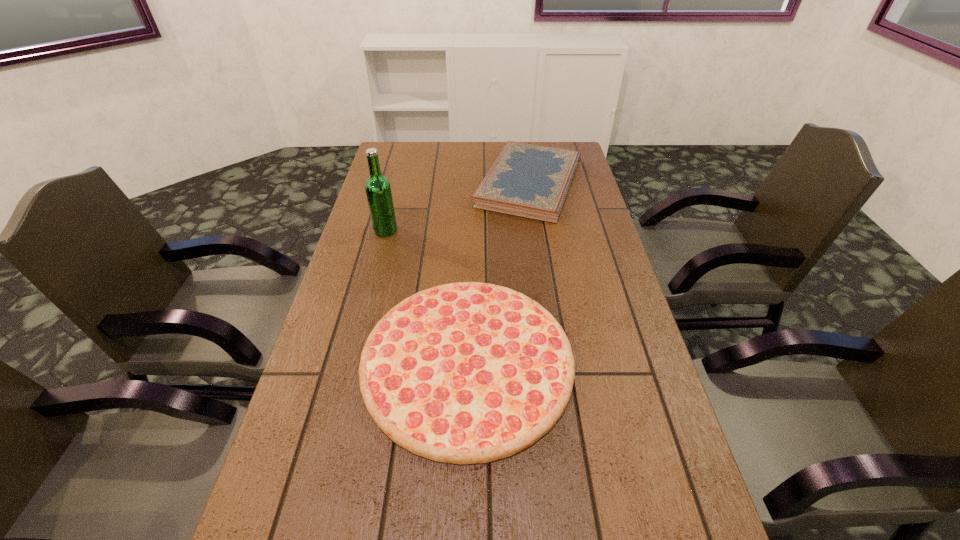
This screenshot has width=960, height=540. I want to click on object located at the right edge, so click(x=527, y=180).

At what (x,y) coordinates should I click in order to perform the action: click on object at the far right corner. Please return your answer as a coordinate pair (x, y). This screenshot has height=540, width=960. Looking at the image, I should click on (527, 180).

Where is `free point at the left edge`? The image size is (960, 540). free point at the left edge is located at coordinates click(358, 224).

In the image, there is a desktop. Where is `vacant space at the right edge`? This screenshot has height=540, width=960. vacant space at the right edge is located at coordinates (579, 187).

This screenshot has width=960, height=540. What are the coordinates of `vacant area that lies between the second shortest object and the tallest object` in the screenshot? It's located at (458, 207).

Find the location of a particular element. The width and height of the screenshot is (960, 540). free space that is in between the paperback book and the beer bottle is located at coordinates (458, 207).

Find the location of a particular element. Image resolution: width=960 pixels, height=540 pixels. vacant space that's between the beer bottle and the second tallest object is located at coordinates (458, 207).

Find the location of a particular element. This screenshot has width=960, height=540. vacant point located between the pizza and the paperback book is located at coordinates (498, 272).

Where is `the closest object to the paperback book`? This screenshot has height=540, width=960. the closest object to the paperback book is located at coordinates click(378, 190).

Image resolution: width=960 pixels, height=540 pixels. I want to click on object that is the second closest one to the paperback book, so click(464, 373).